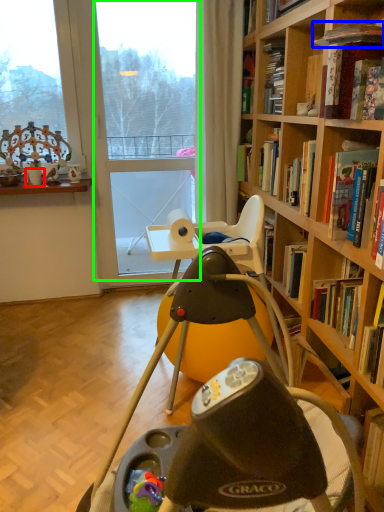
Question: Estimate the real-world distances between objects in this image. Which object is farther from coffee cup (highlighted by a red box), book (highlighted by a blue box) or glass door (highlighted by a green box)?

Choices:
 (A) book
 (B) glass door

Answer: (A)